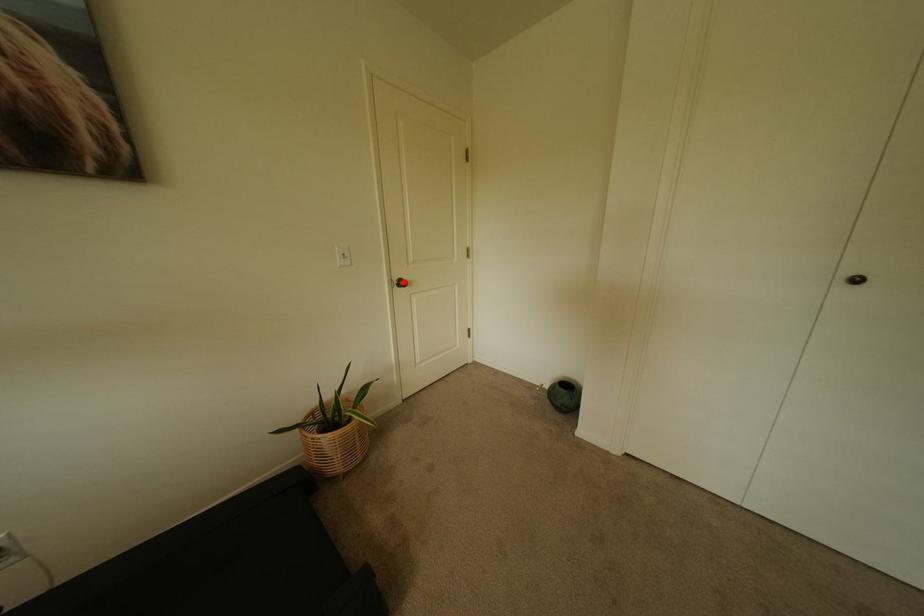
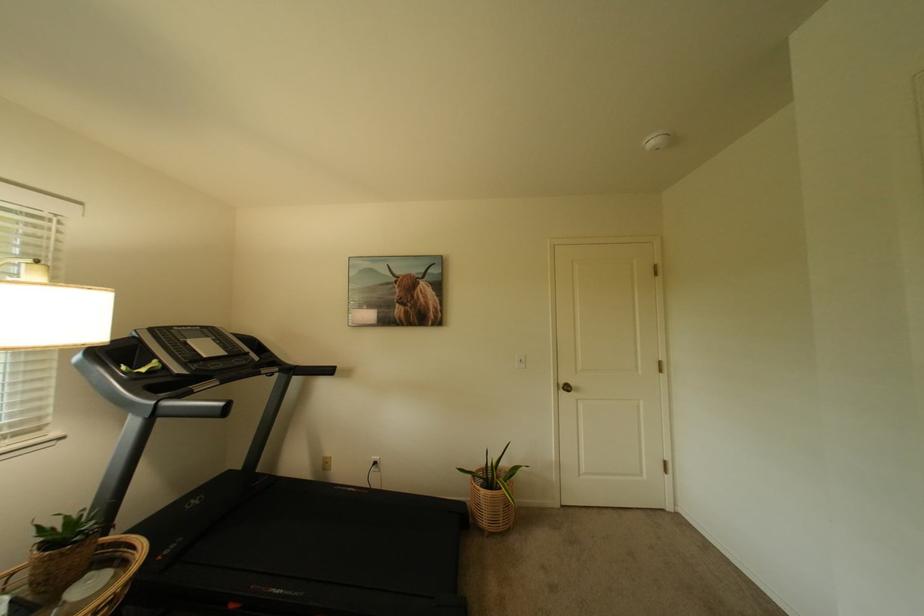
Locate, in the second image, the point that corresponds to the highlighted location in the first image.

(569, 386)